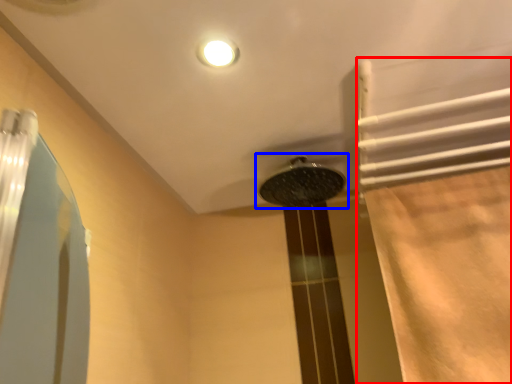
Question: Which point is closer to the camera, shower curtain (highlighted by a red box) or shower (highlighted by a blue box)?

Choices:
 (A) shower curtain
 (B) shower

Answer: (A)